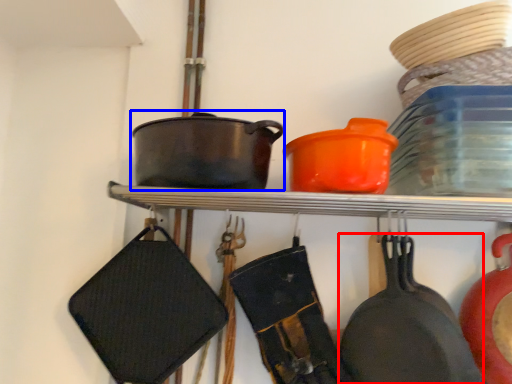
Question: Which object appears farthest to the camera in this image, frying pan (highlighted by a red box) or wok (highlighted by a blue box)?

Choices:
 (A) frying pan
 (B) wok

Answer: (B)